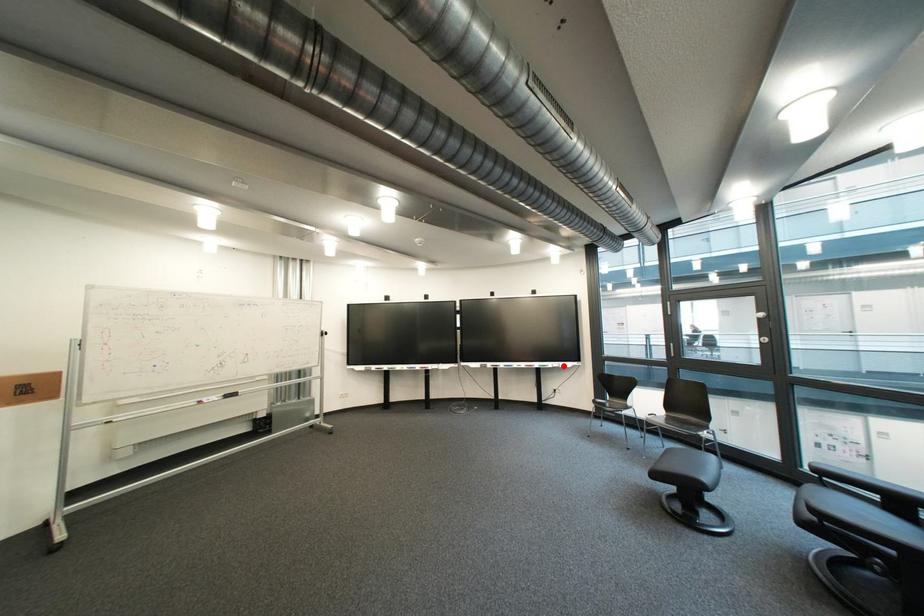
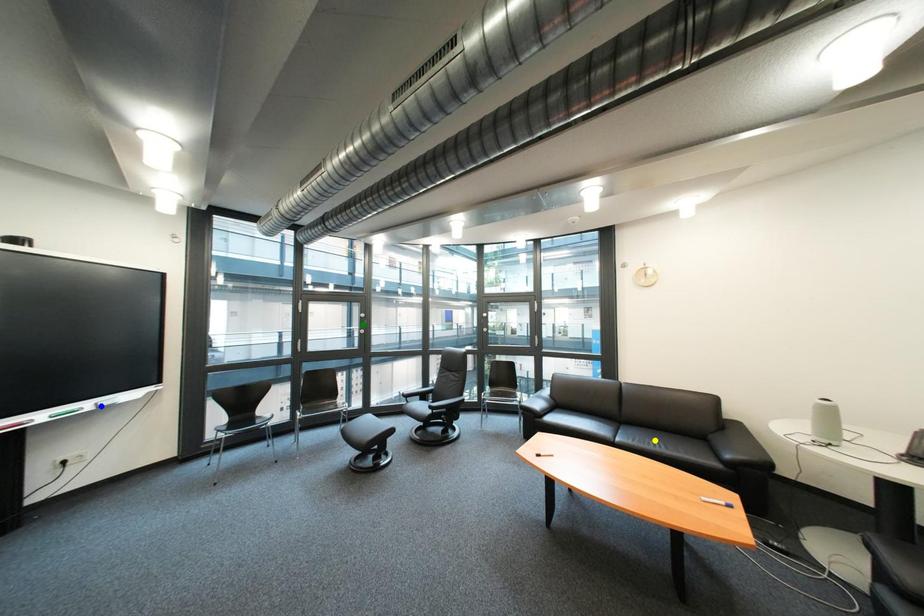
Question: I am providing you with two images of the same scene from different viewpoints. A red point is marked on the first image. You are given multiple points on the second image. Which point in image 2 represents the same 3d spot as the red point in image 1?

Choices:
 (A) blue point
 (B) yellow point
 (C) green point

Answer: (A)